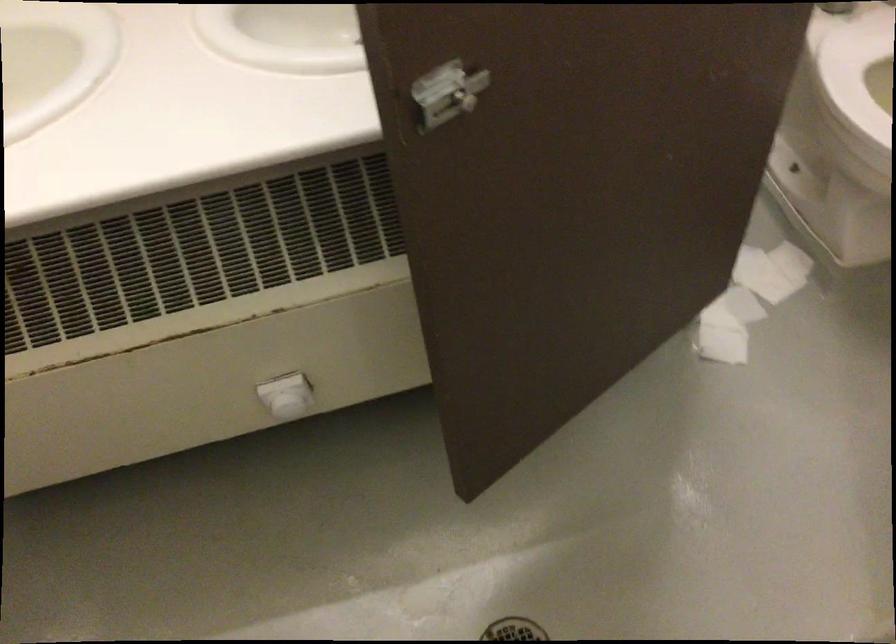
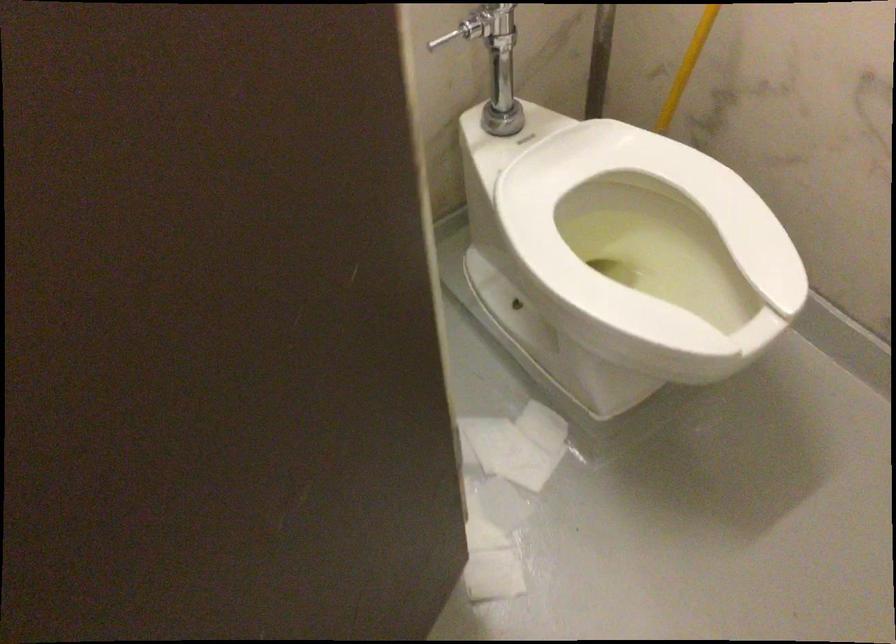
What movement of the cameraman would produce the second image?

The cameraman moved toward right, forward.